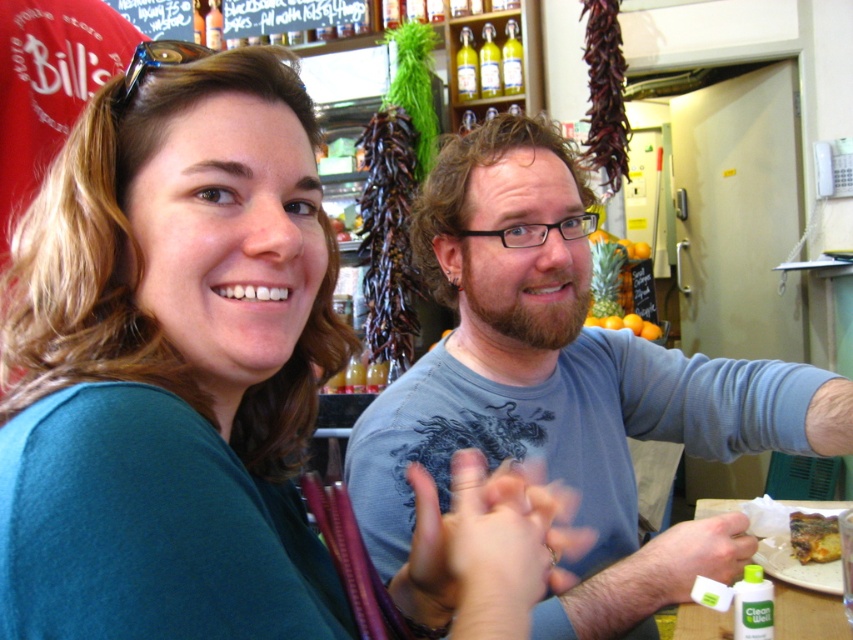
You are a customer in the store and want to ask the staff member wearing the teal fabric shirt at upper left a question. To get their attention, you should look where relative to the blue reflective sunglasses at upper left?

The teal fabric shirt at upper left is below the blue reflective sunglasses at upper left, so you should look downward from the blue reflective sunglasses at upper left to find the staff member.

You are a customer in the store and want to ask the person wearing the blue cotton shirt at center a question. Which direction should you walk from the blue reflective sunglasses at upper left to reach them?

The blue cotton shirt at center is to the right of blue reflective sunglasses at upper left. So you should walk to the right from the blue reflective sunglasses at upper left to reach the blue cotton shirt at center.

You are taking a photo of the scene and want to focus on both point (482, 435) and point (170, 49). Which point should you focus on first to ensure both are in focus?

You should focus on point (170, 49) first because it is closer to the camera than point (482, 435). By focusing on the closer point, the further point will also be within the depth of field.